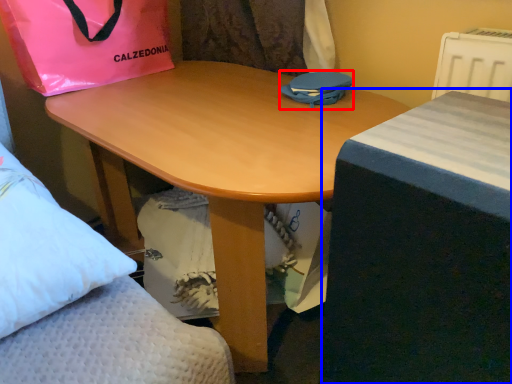
Question: Which object is further to the camera taking this photo, bag (highlighted by a red box) or table (highlighted by a blue box)?

Choices:
 (A) bag
 (B) table

Answer: (A)